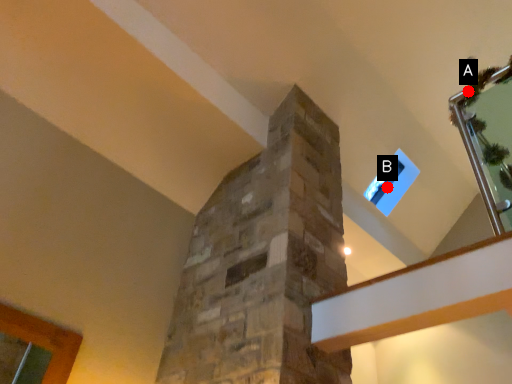
Question: Two points are circled on the image, labeled by A and B beside each circle. Among these points, which one is farthest from the camera?

Choices:
 (A) A is further
 (B) B is further

Answer: (B)